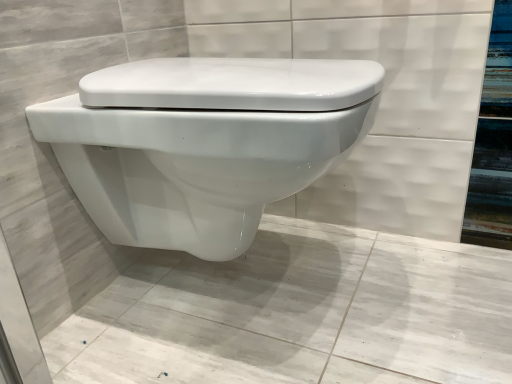
Image resolution: width=512 pixels, height=384 pixels. Identify the location of vacant area located to the right-hand side of white glossy toilet at center. (429, 287).